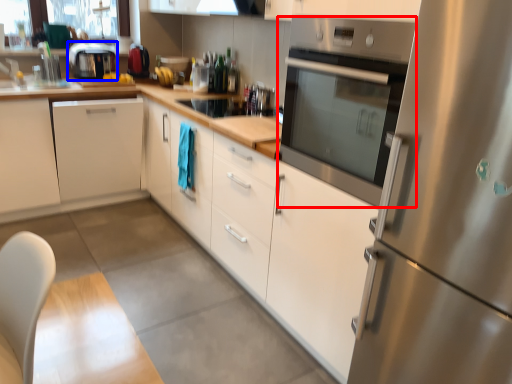
Question: Which object appears closest to the camera in this image, home appliance (highlighted by a red box) or kitchen appliance (highlighted by a blue box)?

Choices:
 (A) home appliance
 (B) kitchen appliance

Answer: (A)